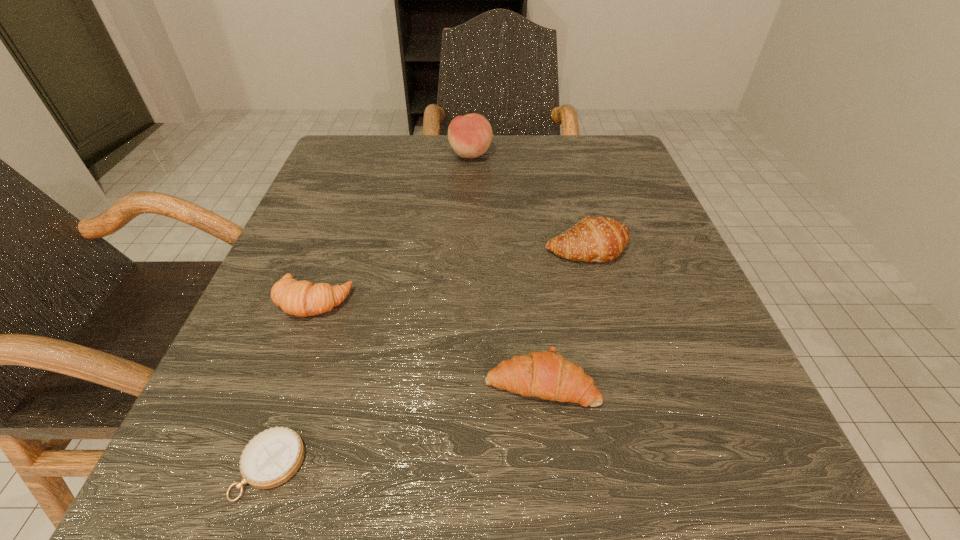
At what (x,y) coordinates should I click in order to perform the action: click on vacant area in the image that satisfies the following two spatial constraints: 1. on the front side of the tallest object; 2. on the left side of the fourth farthest object. Please return your answer as a coordinate pair (x, y). This screenshot has height=540, width=960. Looking at the image, I should click on click(x=463, y=382).

The image size is (960, 540). Identify the location of free space that satisfies the following two spatial constraints: 1. on the back side of the second nearest object; 2. on the left side of the tallest crescent roll. (526, 248).